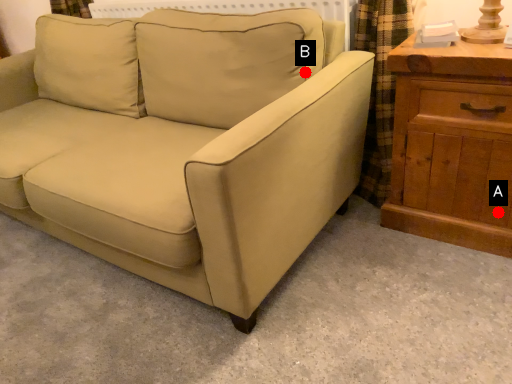
Question: Two points are circled on the image, labeled by A and B beside each circle. Which point is farther from the camera taking this photo?

Choices:
 (A) A is further
 (B) B is further

Answer: (B)